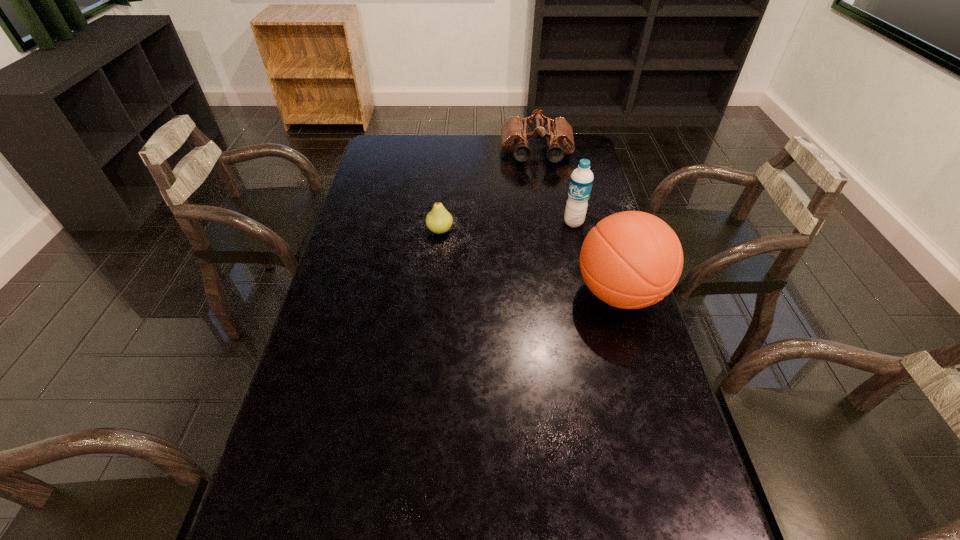
Identify the location of vacant space located 0.270m through the eyepieces of the farthest object. (541, 210).

Find the location of a particular element. vacant space situated through the eyepieces of the farthest object is located at coordinates (540, 197).

At what (x,y) coordinates should I click in order to perform the action: click on object that is at the far edge. Please return your answer as a coordinate pair (x, y). The width and height of the screenshot is (960, 540). Looking at the image, I should click on (515, 135).

Identify the location of basketball present at the right edge. This screenshot has width=960, height=540. (632, 259).

You are a GUI agent. You are given a task and a screenshot of the screen. Output one action in this format:
    pyautogui.click(x=<x>, y=<y>)
    Task: Click on the water bottle that is positioned at the right edge
    The height and width of the screenshot is (540, 960).
    Given the screenshot: What is the action you would take?
    pyautogui.click(x=581, y=180)

Identify the location of binoculars at the right edge. (515, 135).

Find the location of a particular element. object at the far right corner is located at coordinates (515, 135).

This screenshot has height=540, width=960. In order to click on free space at the far edge of the desktop in this screenshot , I will do `click(453, 164)`.

The width and height of the screenshot is (960, 540). Find the location of `vacant space at the left edge of the desktop`. vacant space at the left edge of the desktop is located at coordinates (344, 245).

The height and width of the screenshot is (540, 960). Find the location of `blank space at the right edge of the desktop`. blank space at the right edge of the desktop is located at coordinates coord(576,243).